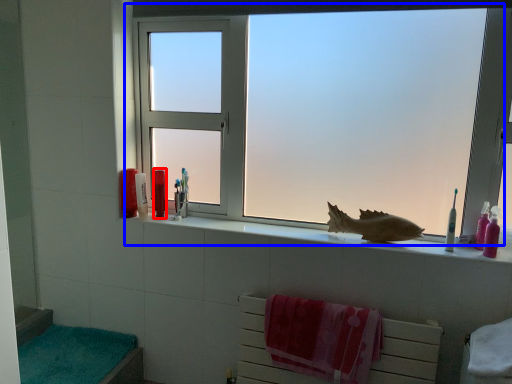
Question: Which object is further to the camera taking this photo, toiletry (highlighted by a red box) or window (highlighted by a blue box)?

Choices:
 (A) toiletry
 (B) window

Answer: (A)